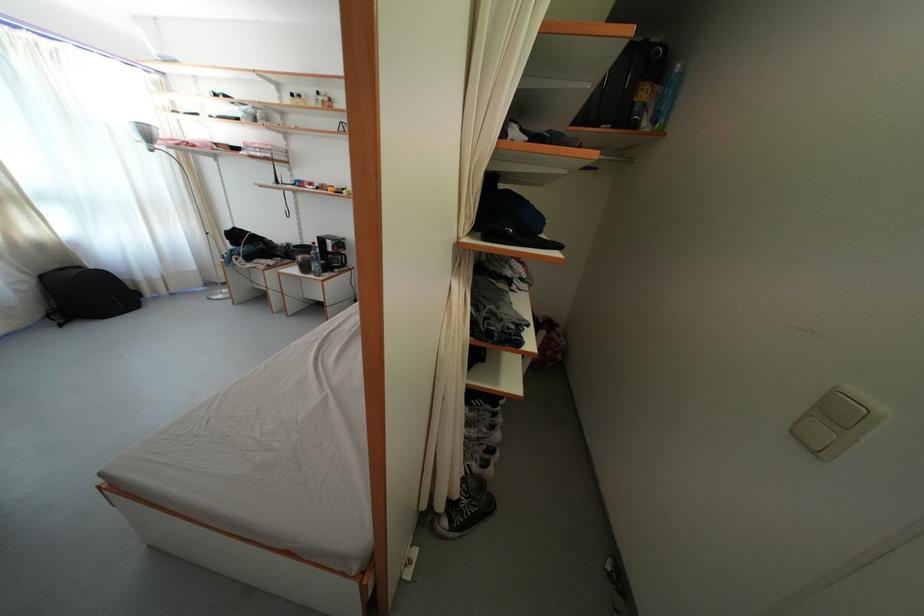
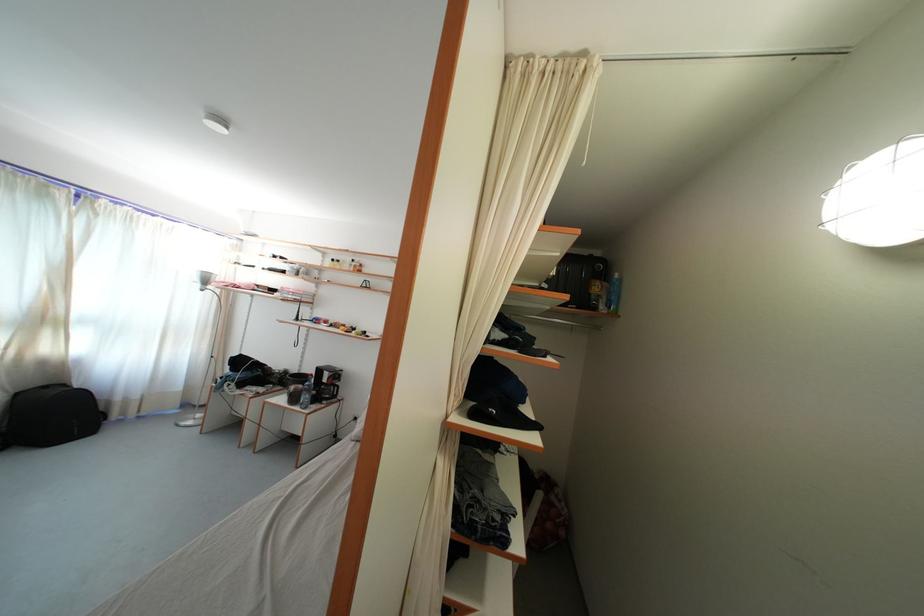
Find the pixel in the second image that matches pixel 661 129 in the first image.

(615, 314)